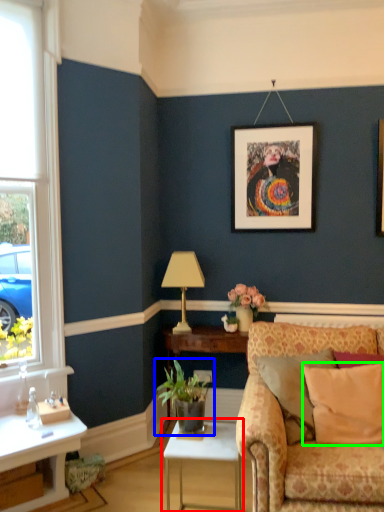
Question: Which is nearer to the table (highlighted by a red box)? houseplant (highlighted by a blue box) or pillow (highlighted by a green box).

Choices:
 (A) houseplant
 (B) pillow

Answer: (A)